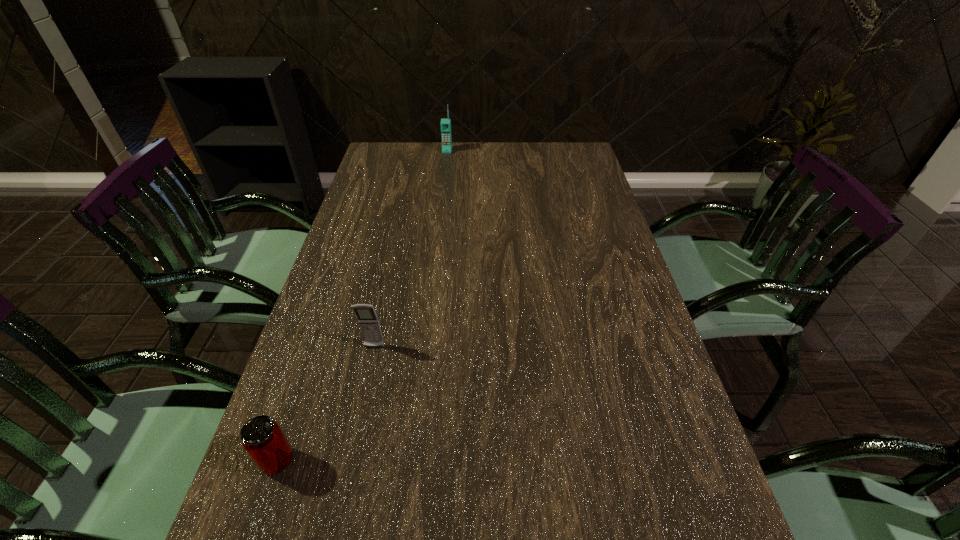
This screenshot has height=540, width=960. What are the coordinates of `cellular telephone located at the left edge` in the screenshot? It's located at (368, 321).

Where is `soda can that is at the left edge`? This screenshot has width=960, height=540. soda can that is at the left edge is located at coordinates (262, 438).

I want to click on vacant space at the far edge, so click(454, 172).

Identify the location of free space at the left edge of the desktop. The image size is (960, 540). (367, 188).

I want to click on vacant area at the right edge, so click(x=667, y=394).

Identify the location of vacant space at the far right corner of the desktop. The height and width of the screenshot is (540, 960). (564, 144).

You are a GUI agent. You are given a task and a screenshot of the screen. Output one action in this format:
    pyautogui.click(x=<x>, y=<y>)
    Task: Click on the vacant region between the shortest object and the second shortest object
    This screenshot has height=540, width=960.
    Given the screenshot: What is the action you would take?
    pyautogui.click(x=325, y=404)

In order to click on empty space between the rightmost object and the second tallest object in this screenshot , I will do `click(411, 249)`.

Identify the location of free space between the second tallest object and the soda can. Image resolution: width=960 pixels, height=540 pixels. (325, 404).

Find the location of a particular element. This screenshot has width=960, height=540. vacant space that is in between the second farthest object and the right cellular telephone is located at coordinates (411, 249).